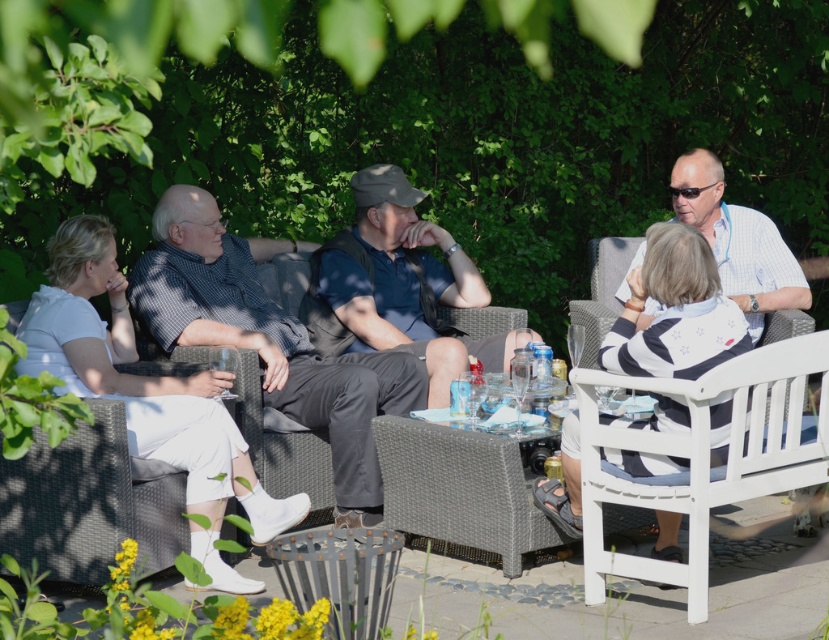
You are planning to place a small potted plant between the white wood bench at lower right and the white wicker chair at left. Based on their positions, will the plant be closer to the bench or the chair?

The white wood bench at lower right is above the white wicker chair at left, so the plant placed between them would be closer to the chair at left since it is positioned lower.